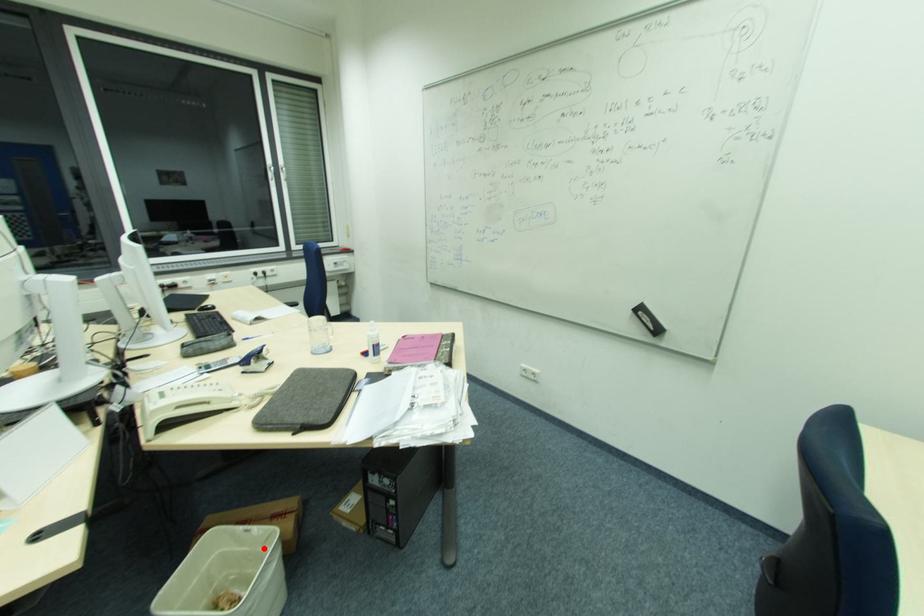
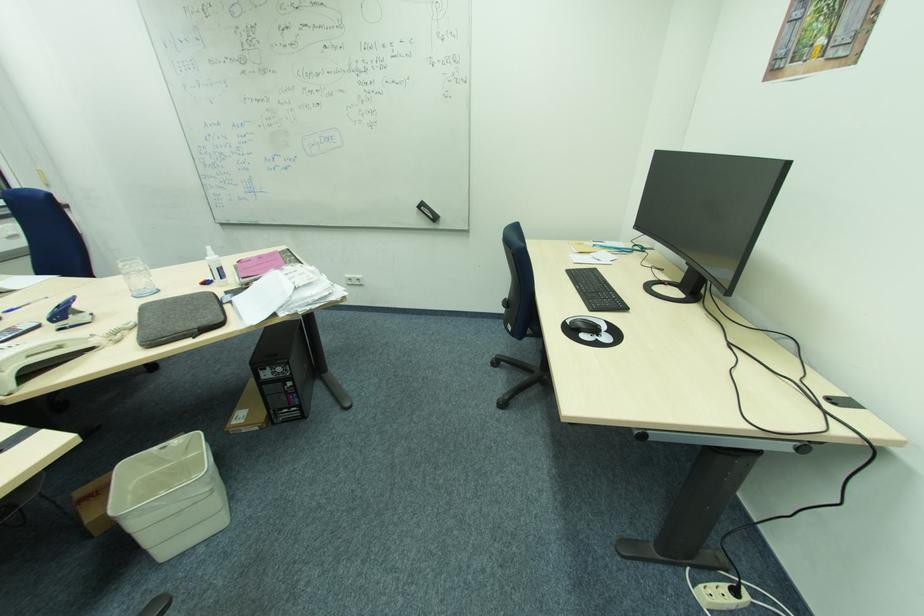
The point at the highlighted location is marked in the first image. Where is the corresponding point in the second image?

(187, 459)